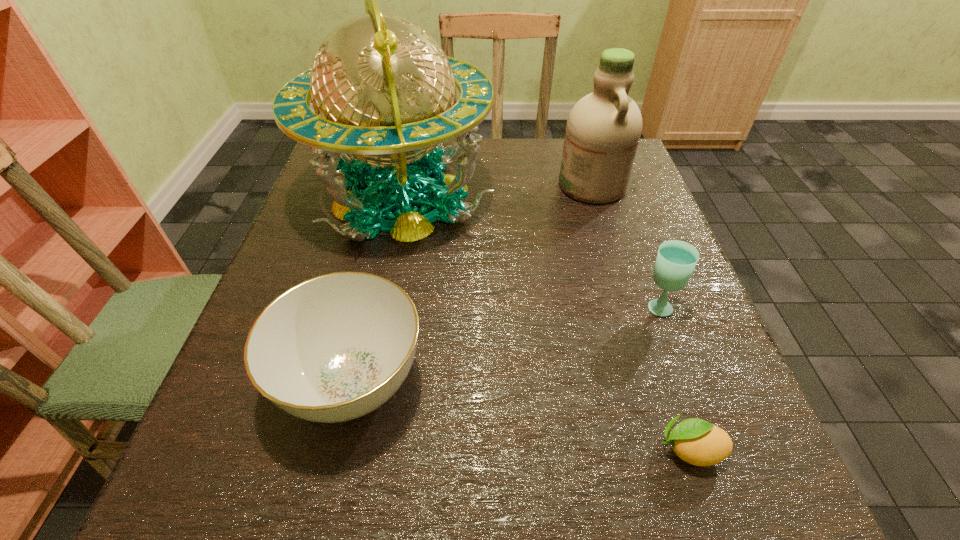
I want to click on vacant space at the right edge of the desktop, so [x=617, y=299].

In the image, there is a desktop. At what (x,y) coordinates should I click in order to perform the action: click on blank space at the near left corner. Please return your answer as a coordinate pair (x, y). The width and height of the screenshot is (960, 540). Looking at the image, I should click on (308, 458).

Locate an element on the screen. empty location between the second tallest object and the chinaware is located at coordinates (472, 284).

Where is `vacant area that lies between the chinaware and the lemon`? vacant area that lies between the chinaware and the lemon is located at coordinates (521, 415).

This screenshot has height=540, width=960. I want to click on empty space between the globe and the fourth shortest object, so point(496,192).

You are a GUI agent. You are given a task and a screenshot of the screen. Output one action in this format:
    pyautogui.click(x=<x>, y=<y>)
    Task: Click on the vacant space that is in between the tallest object and the glass
    This screenshot has width=960, height=540.
    Given the screenshot: What is the action you would take?
    pyautogui.click(x=529, y=252)

Image resolution: width=960 pixels, height=540 pixels. Find the location of `vacant space in between the lemon and the second tallest object`. vacant space in between the lemon and the second tallest object is located at coordinates (x=640, y=317).

Image resolution: width=960 pixels, height=540 pixels. What are the coordinates of `vacant space that's between the shortest object and the third farthest object` in the screenshot? It's located at (673, 377).

At what (x,y) coordinates should I click in order to perform the action: click on object that is the nearest to the shortest object. Please return your answer as a coordinate pair (x, y). The height and width of the screenshot is (540, 960). Looking at the image, I should click on (676, 260).

The image size is (960, 540). Find the location of `object that stands as the second closest to the globe`. object that stands as the second closest to the globe is located at coordinates (603, 130).